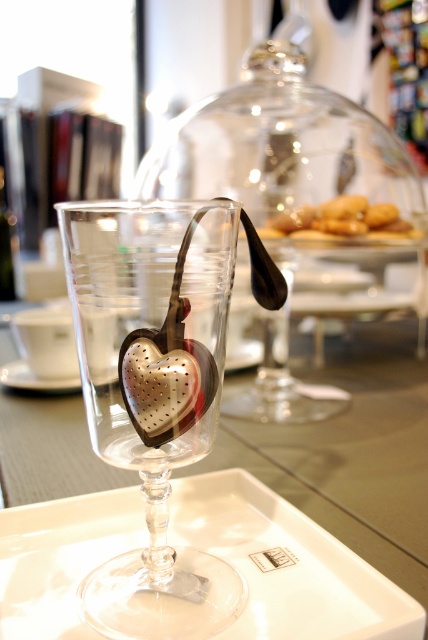
Is clear glass wine glass at center in front of white glossy tray at center?

Yes, clear glass wine glass at center is closer to the viewer.

Based on the photo, which is below, clear glass wine glass at center or white glossy tray at center?

white glossy tray at center is below.

Who is more distant from viewer, (103, 220) or (267, 563)?

Positioned behind is point (267, 563).

Where is `clear glass wine glass at center`? The width and height of the screenshot is (428, 640). clear glass wine glass at center is located at coordinates (151, 397).

Between point (20, 508) and point (350, 195), which one is positioned in front?

Point (20, 508)

Which is above, white glossy tray at center or golden brown cookie at center?

Positioned higher is golden brown cookie at center.

Describe the element at coordinates (287, 564) in the screenshot. The width and height of the screenshot is (428, 640). I see `white glossy tray at center` at that location.

Identify the location of white glossy tray at center. The image size is (428, 640). (287, 564).

Who is positioned more to the left, satin silver heart at center or golden brown cookie at center?

From the viewer's perspective, satin silver heart at center appears more on the left side.

Between satin silver heart at center and golden brown cookie at center, which one is positioned higher?

golden brown cookie at center is above.

Is point (177, 387) closer to camera compared to point (377, 228)?

That is True.

Where is `satin silver heart at center`? This screenshot has width=428, height=640. satin silver heart at center is located at coordinates (165, 381).